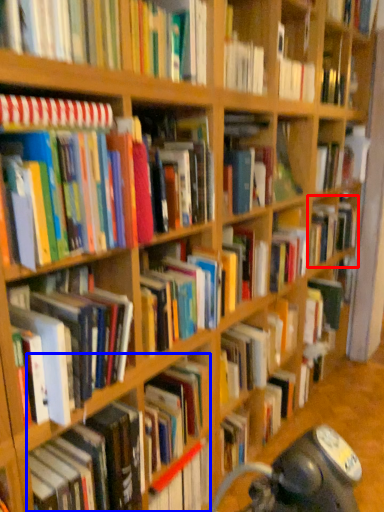
Question: Among these objects, which one is farthest to the camera, book (highlighted by a red box) or book (highlighted by a blue box)?

Choices:
 (A) book
 (B) book

Answer: (A)